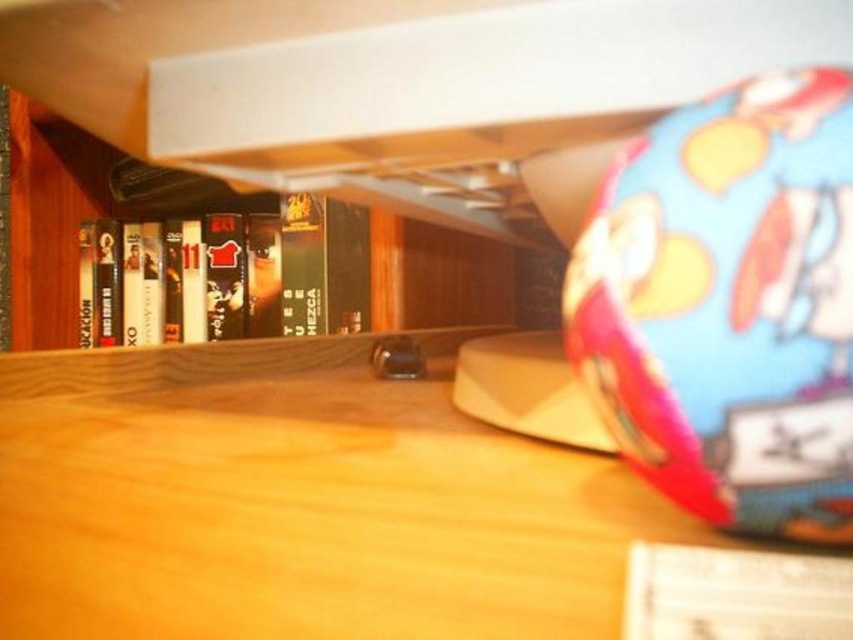
You are organizing items on a wooden desk. You have a wooden table at center and a black matte dvd case at center. Which item is closer to you?

The black matte dvd case at center is closer to you because it is positioned above the wooden table at center.

You are organizing items on the wooden table at center and the black matte book at center. If you want to place a new object between them, where should you position it?

The wooden table at center is to the right of the black matte book at center, so you should place the new object in between them, to the left of the wooden table at center and to the right of the black matte book at center.

You are organizing items on a desk and need to place two stickers at specific coordinates. The first sticker should be placed at point (395, 289) and the second at point (323, 320). Which sticker will be closer to the viewer?

The sticker at point (395, 289) will be closer to the viewer because it is in front of point (323, 320).